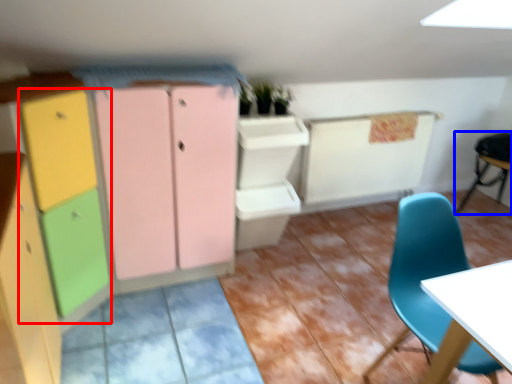
Question: Among these objects, which one is nearest to the camera, cabinetry (highlighted by a red box) or chair (highlighted by a blue box)?

Choices:
 (A) cabinetry
 (B) chair

Answer: (A)